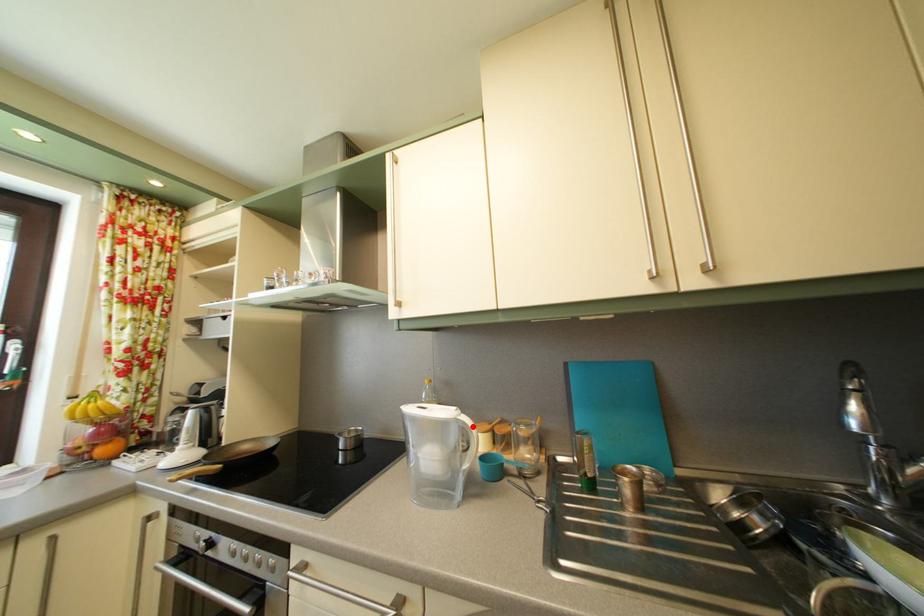
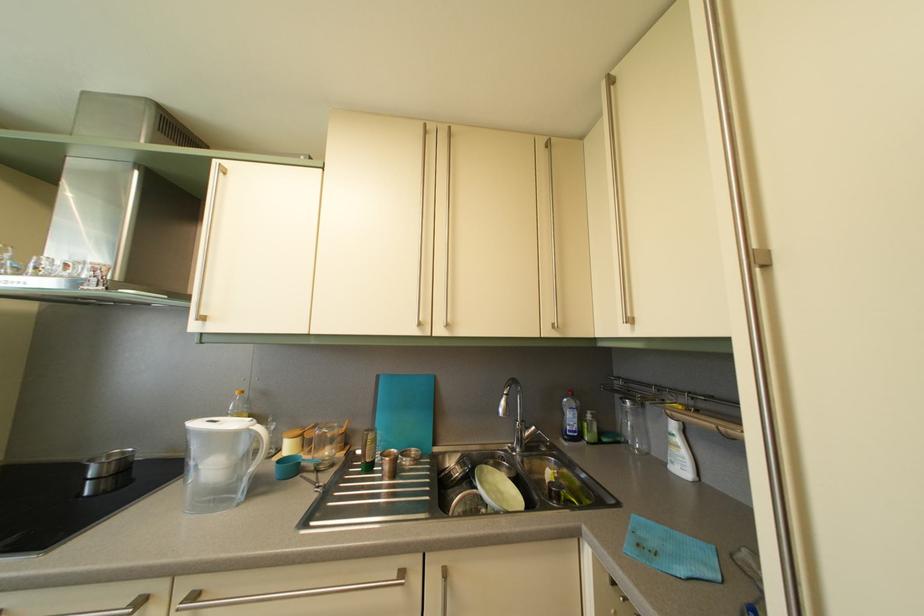
Question: I am providing you with two images of the same scene from different viewpoints. Given a red point in image1, look at the same physical point in image2. Is it:

Choices:
 (A) Closer to the viewpoint
 (B) Farther from the viewpoint

Answer: (A)